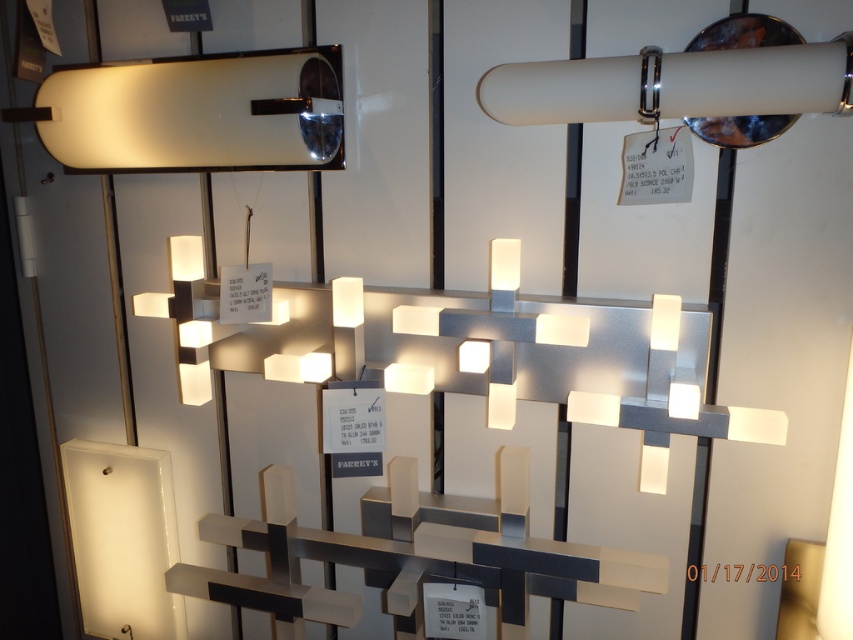
You are an interior designer planning to install two light fixtures in a small office. You have the satin white glass at upper left and the satin white tube at upper right. Given the space constraints, which fixture would you choose to ensure it doesn not overwhelm the room?

You should choose the satin white tube at upper right because it is smaller than the satin white glass at upper left, making it more suitable for a small office space.

You are a customer in a lighting store looking at the display. You see the satin white glass at upper left and the satin white tube at upper right. Which one is positioned more to the left side of the display?

The satin white glass at upper left is positioned more to the left side of the display than the satin white tube at upper right.